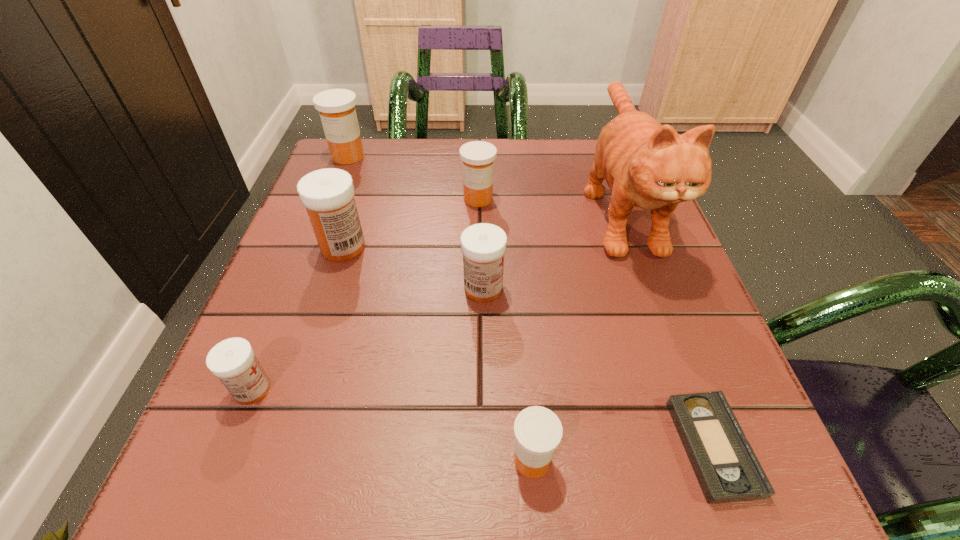
Identify the location of the smallest white medicine. [x=233, y=361].

Find the location of `the second nearest medicine`. the second nearest medicine is located at coordinates (233, 361).

Image resolution: width=960 pixels, height=540 pixels. I want to click on the rightmost orange medicine, so (x=538, y=431).

The image size is (960, 540). Find the location of `the nearest medicine`. the nearest medicine is located at coordinates (538, 431).

Where is `videotape`? videotape is located at coordinates (727, 469).

At what (x,y) coordinates should I click in order to perform the action: click on free region located on the face of the ginger cat. Please return your answer as a coordinate pair (x, y). Looking at the image, I should click on (710, 455).

Identify the location of vacant region located 0.160m on the label of the biggest orange medicine. (328, 207).

This screenshot has width=960, height=540. I want to click on free space located on the back of the third farthest medicine, so click(x=375, y=146).

Where is `vacant space located on the label of the second biggest orange medicine`? The height and width of the screenshot is (540, 960). vacant space located on the label of the second biggest orange medicine is located at coordinates (478, 284).

This screenshot has width=960, height=540. I want to click on vacant space located on the front of the fourth farthest medicine, so click(485, 446).